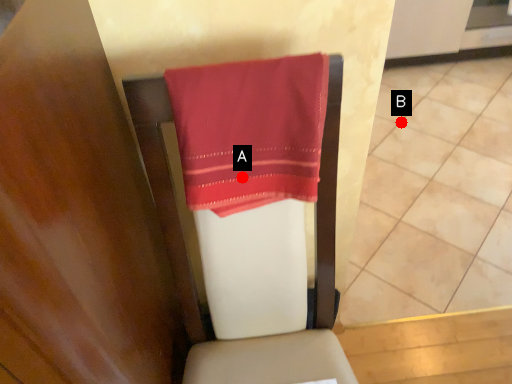
Question: Two points are circled on the image, labeled by A and B beside each circle. Which of the following is the farthest from the observer?

Choices:
 (A) A is further
 (B) B is further

Answer: (B)